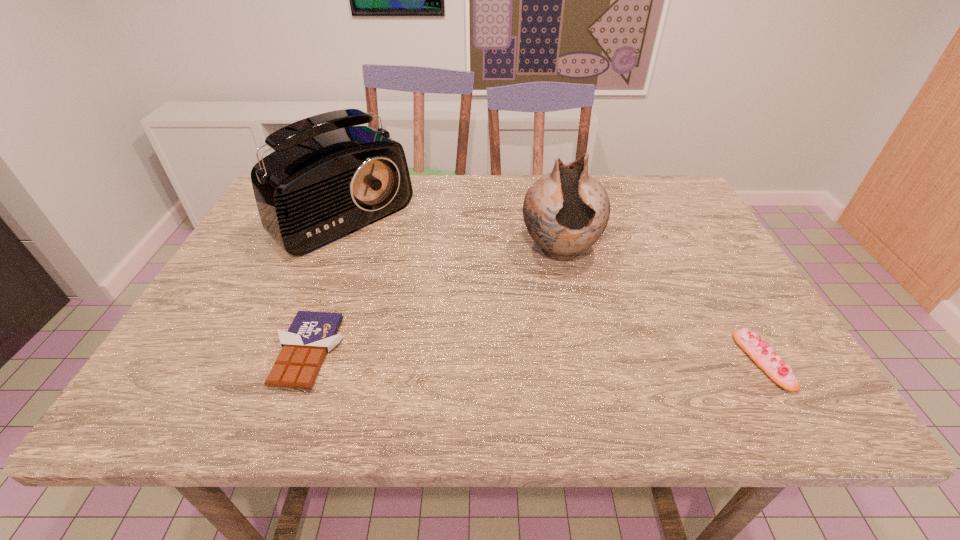
Identify the location of vacant space on the desktop that is between the chocolate bar and the second shortest object and is positioned on the front-facing side of the radio receiver. Image resolution: width=960 pixels, height=540 pixels. (516, 356).

The width and height of the screenshot is (960, 540). I want to click on free space on the desktop that is between the shortest object and the third tallest object and is positioned from the spout of the pottery, so click(580, 357).